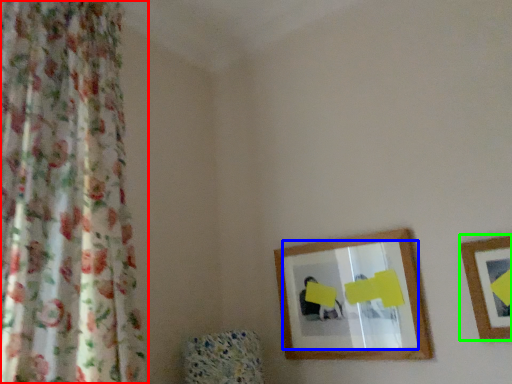
Question: Which object is the closest to the curtain (highlighted by a red box)? Choose among these: mirror (highlighted by a blue box) or picture frame (highlighted by a green box).

Choices:
 (A) mirror
 (B) picture frame

Answer: (A)